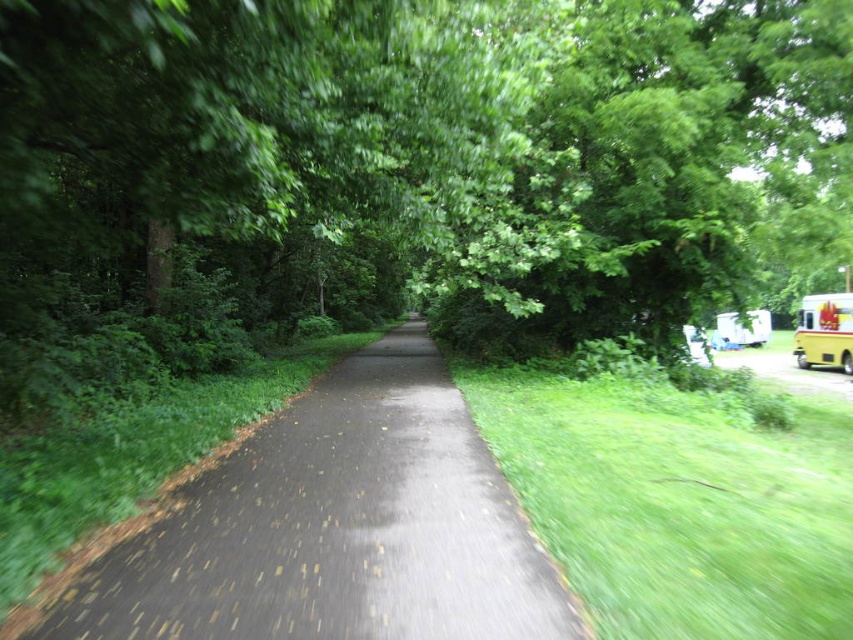
Question: Estimate the real-world distances between objects in this image. Which object is closer to the green leafy tree at center?

Choices:
 (A) black asphalt path at center
 (B) yellow matte school bus at right

Answer: (A)

Question: Which of the following is the closest to the observer?

Choices:
 (A) green leafy tree at center
 (B) black asphalt path at center
 (C) yellow matte school bus at right

Answer: (B)

Question: Does black asphalt path at center have a greater width compared to yellow matte school bus at right?

Choices:
 (A) no
 (B) yes

Answer: (A)

Question: Can you confirm if black asphalt path at center is bigger than yellow matte school bus at right?

Choices:
 (A) no
 (B) yes

Answer: (A)

Question: Which of the following is the closest to the observer?

Choices:
 (A) (846, 371)
 (B) (318, 566)

Answer: (B)

Question: Can you confirm if green leafy tree at center is wider than yellow matte school bus at right?

Choices:
 (A) yes
 (B) no

Answer: (A)